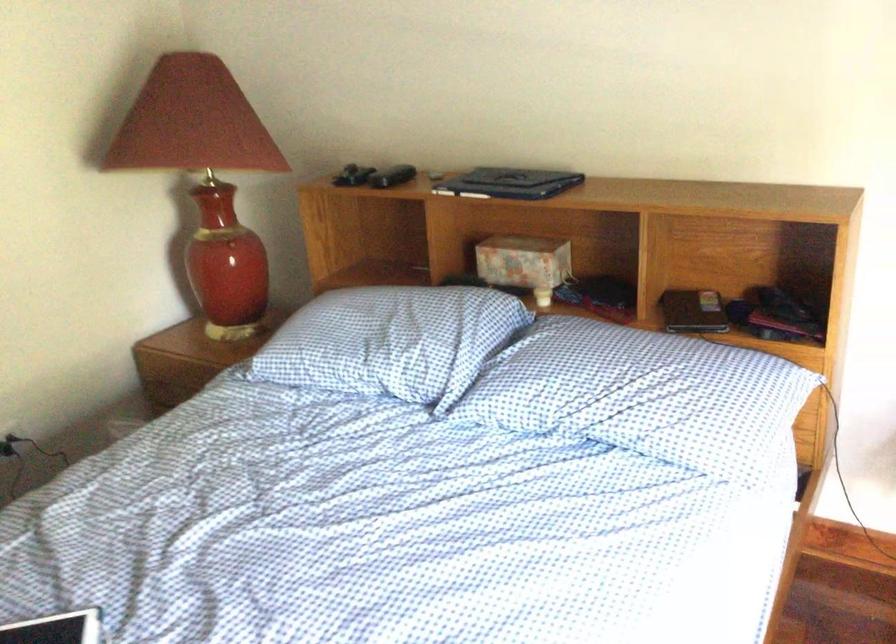
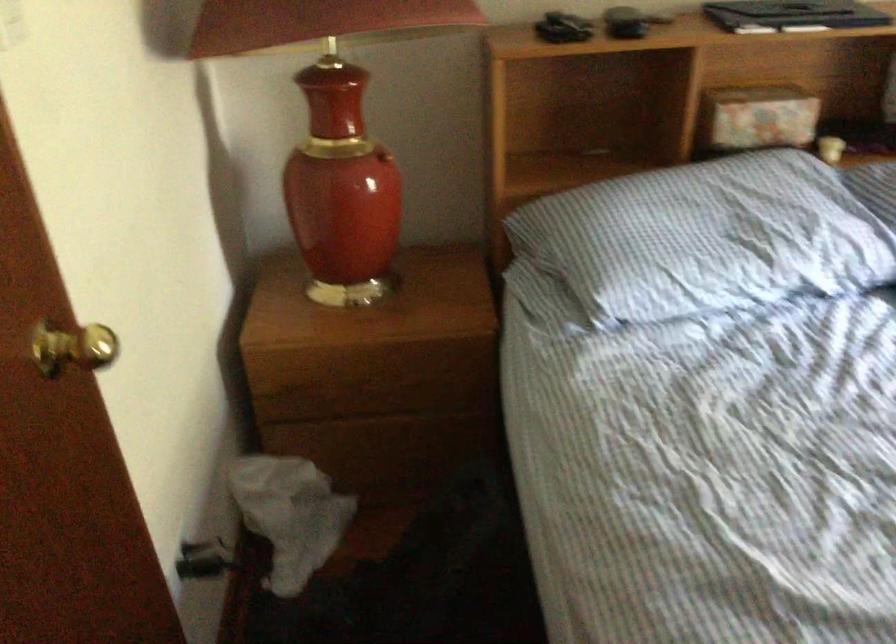
Where in the second image is the point corresponding to pixel 495 261 from the first image?

(757, 118)